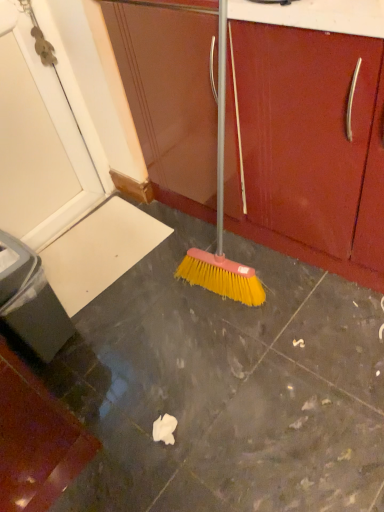
Question: Do you think yellow bristle broom at center is within matte wood cabinet at center, or outside of it?

Choices:
 (A) outside
 (B) inside

Answer: (A)

Question: From the image's perspective, is yellow bristle broom at center located above or below matte wood cabinet at center?

Choices:
 (A) below
 (B) above

Answer: (A)

Question: Considering their positions, is yellow bristle broom at center located in front of or behind matte wood cabinet at center?

Choices:
 (A) front
 (B) behind

Answer: (A)

Question: Visually, is matte wood cabinet at center positioned to the left or to the right of yellow bristle broom at center?

Choices:
 (A) left
 (B) right

Answer: (A)

Question: Is point (206, 104) closer or farther from the camera than point (261, 41)?

Choices:
 (A) farther
 (B) closer

Answer: (A)

Question: Do you think matte wood cabinet at center is within yellow bristle broom at center, or outside of it?

Choices:
 (A) inside
 (B) outside

Answer: (B)

Question: Looking at their shapes, would you say matte wood cabinet at center is wider or thinner than yellow bristle broom at center?

Choices:
 (A) thin
 (B) wide

Answer: (A)